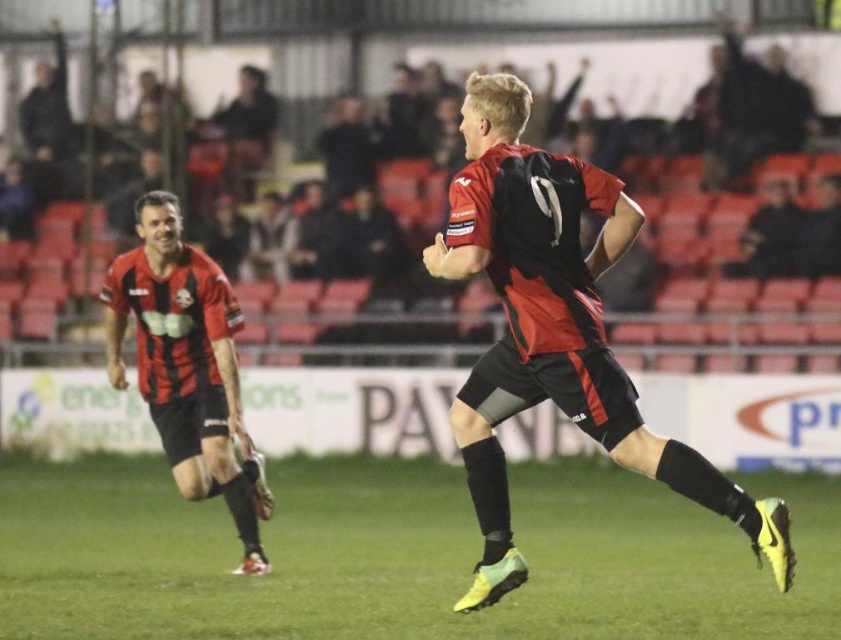
You are a soccer coach analyzing the image. The point at coordinates (554, 330) is marked. Which player is located at that point?

The point at coordinates (554, 330) corresponds to the matte black jersey at center.

You are a soccer coach analyzing the field layout. You notice the yellow synthetic turf at center and the matte black jersey at left. Which object occupies more space in the image?

The yellow synthetic turf at center occupies more space in the image because it has a larger size compared to the matte black jersey at left.

You are a photographer standing at the edge of the soccer field. You want to take a photo focusing on the yellow synthetic turf at center and the matte black jersey at left. Which object should you adjust your camera focus on first if you want to ensure both are in focus?

The yellow synthetic turf at center is closer to the viewer than the matte black jersey at left. To ensure both are in focus, adjust your camera focus on the yellow synthetic turf at center first since it is closer, and the matte black jersey at left will naturally be in focus as it is further away.